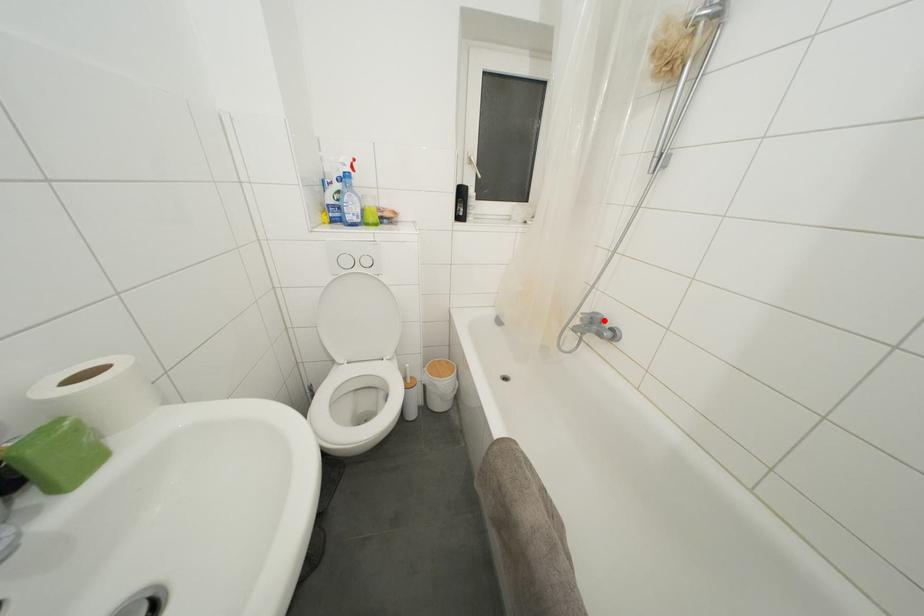
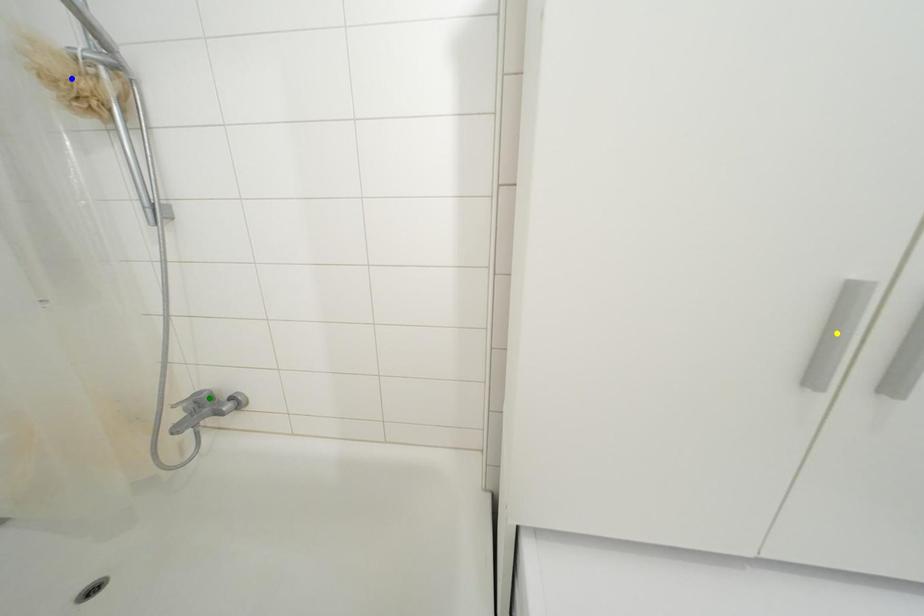
Question: I am providing you with two images of the same scene from different viewpoints. A red point is marked on the first image. You are given multiple points on the second image. Can you choose the point in image 2 that corresponds to the point in image 1?

Choices:
 (A) blue point
 (B) green point
 (C) yellow point

Answer: (B)